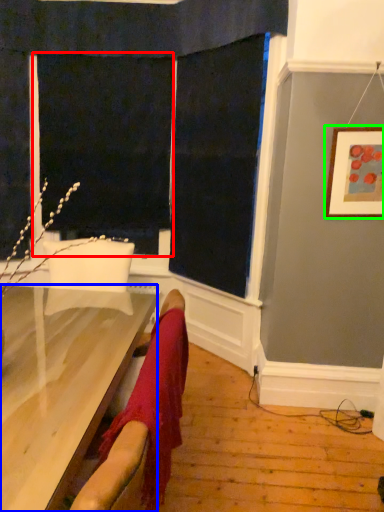
Question: Which object is the farthest from screen door (highlighted by a red box)? Choose among these: furniture (highlighted by a blue box) or picture frame (highlighted by a green box).

Choices:
 (A) furniture
 (B) picture frame

Answer: (A)